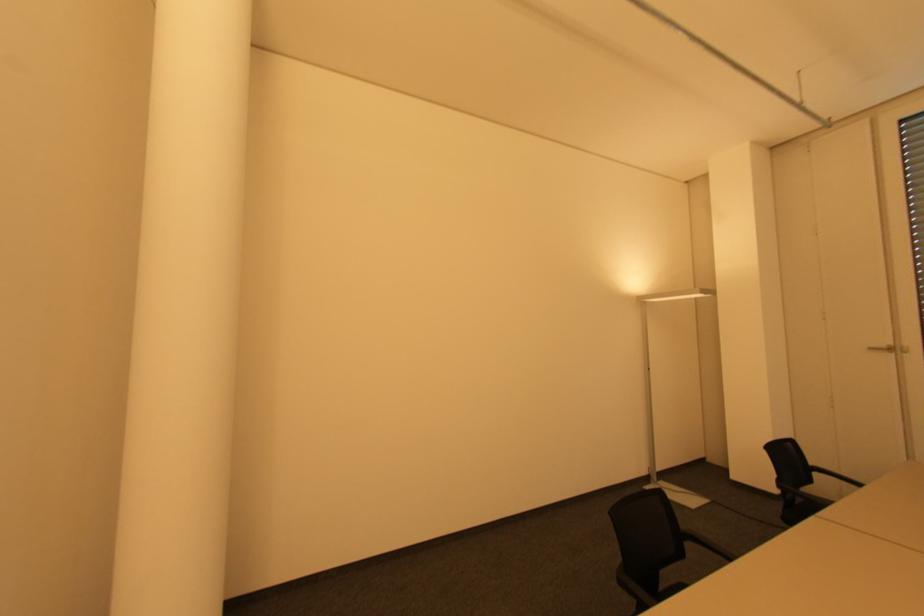
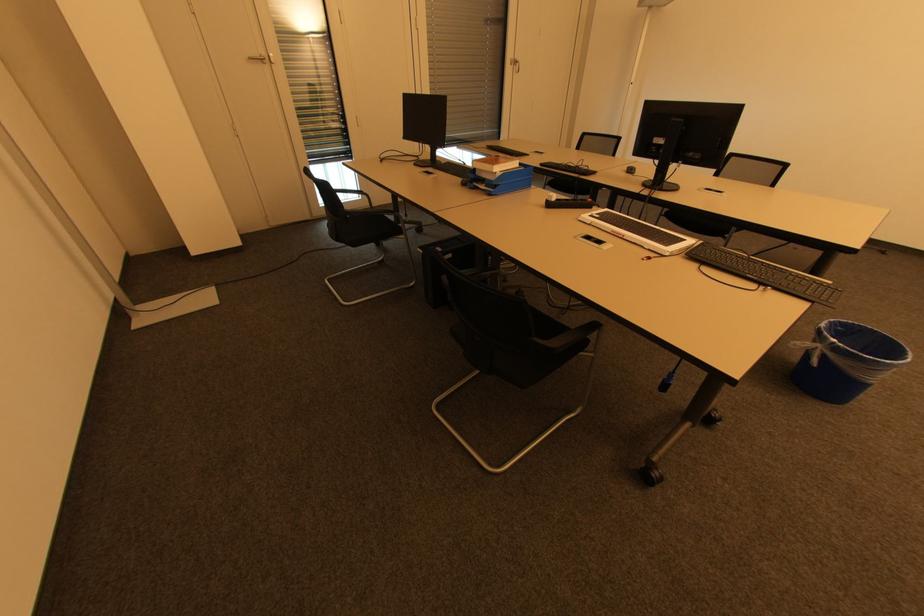
In the second image, find the point that corresponds to the point at 883,346 in the first image.

(258, 55)